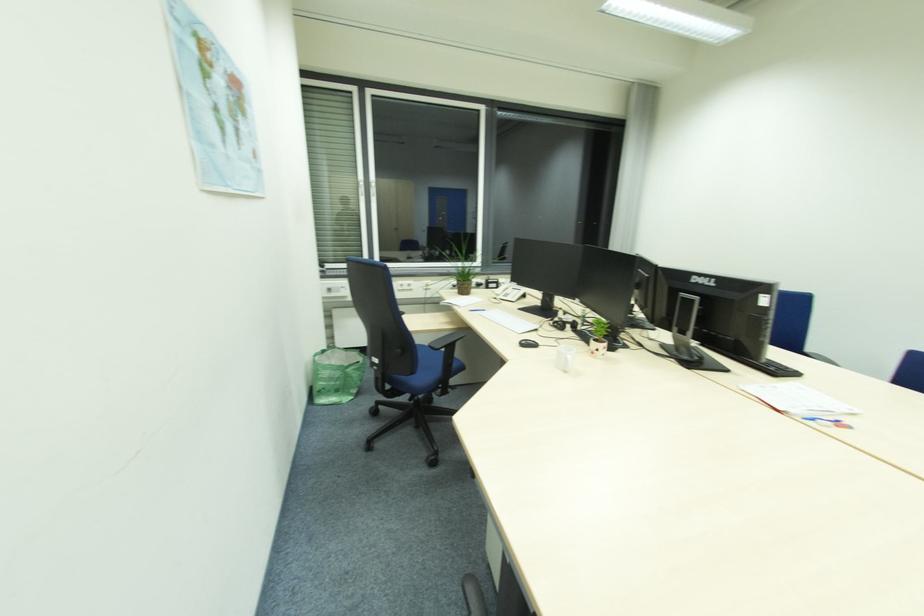
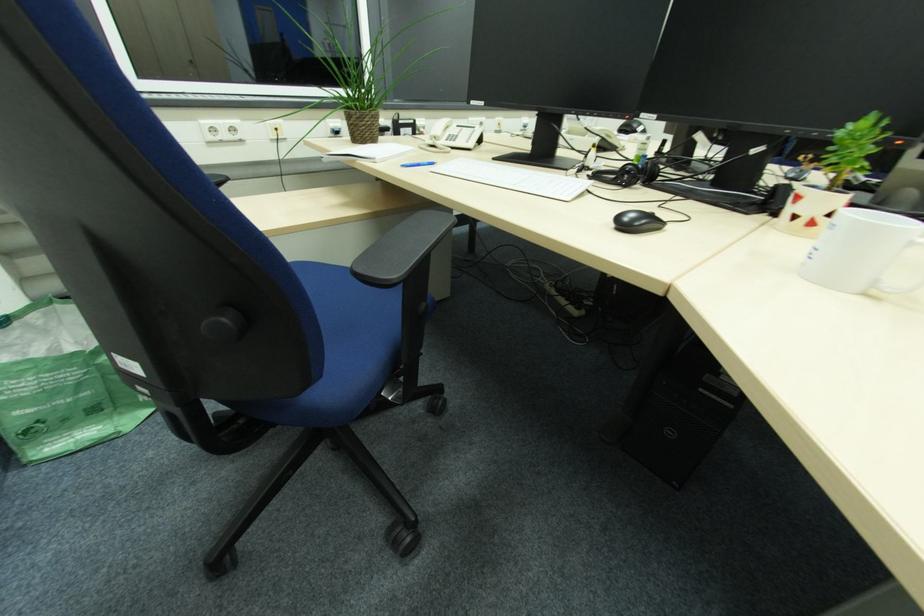
Question: The images are taken continuously from a first-person perspective. In which direction are you moving?

Choices:
 (A) Left
 (B) Right
 (C) Forward
 (D) Backward

Answer: (C)